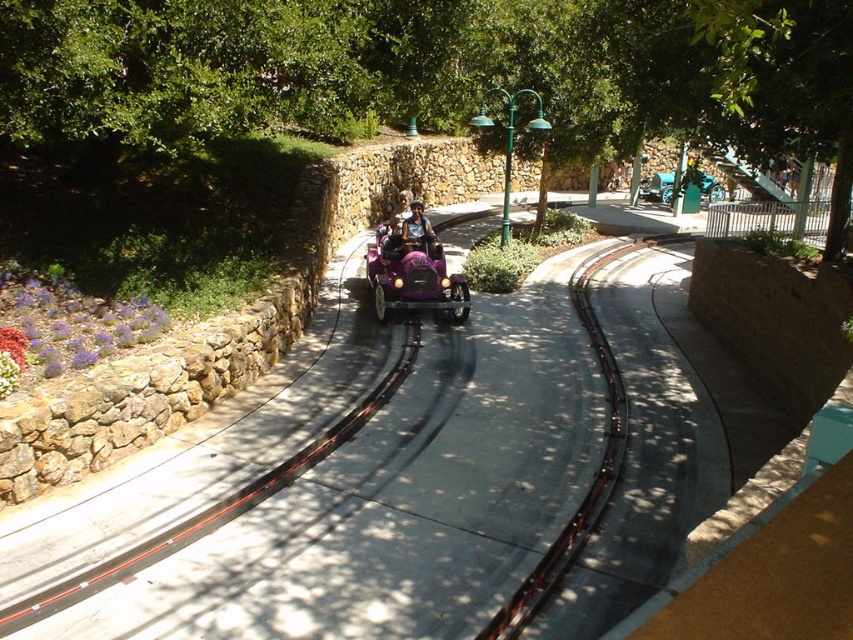
Question: Which object appears closest to the camera in this image?

Choices:
 (A) metallic teal car at center
 (B) matte purple toy car at center

Answer: (B)

Question: Does matte purple toy car at center have a lesser width compared to metallic purple car at center?

Choices:
 (A) yes
 (B) no

Answer: (B)

Question: Observing the image, what is the correct spatial positioning of matte purple toy car at center in reference to metallic purple car at center?

Choices:
 (A) below
 (B) above

Answer: (A)

Question: Which object is farther from the camera taking this photo?

Choices:
 (A) metallic purple car at center
 (B) metallic teal car at center

Answer: (B)

Question: Estimate the real-world distances between objects in this image. Which object is farther from the matte purple toy car at center?

Choices:
 (A) metallic teal car at center
 (B) metallic purple car at center

Answer: (A)

Question: Can you confirm if metallic teal car at center is positioned to the left of metallic purple car at center?

Choices:
 (A) yes
 (B) no

Answer: (B)